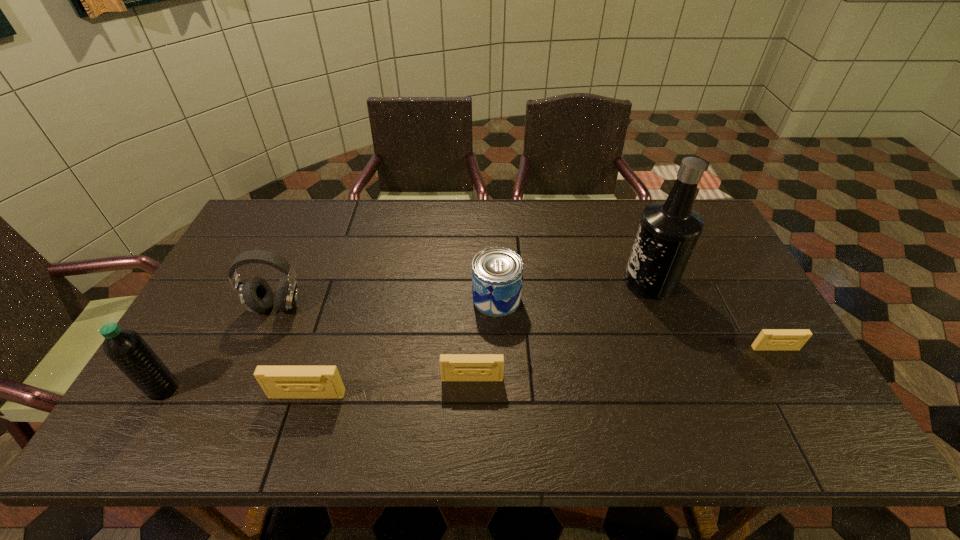
Where is `the sixth shortest object`? This screenshot has width=960, height=540. the sixth shortest object is located at coordinates (126, 348).

Find the location of a particular element. Image resolution: width=960 pixels, height=540 pixels. water bottle is located at coordinates (126, 348).

At what (x,y) coordinates should I click in order to perform the action: click on vacant region located at the front of the second nearest videotape with spools. Please return your answer as a coordinate pair (x, y). This screenshot has height=540, width=960. Looking at the image, I should click on (472, 402).

At what (x,y) coordinates should I click in order to perform the action: click on vacant region located 0.090m at the front of the rightmost videotape with spools. Please return your answer as a coordinate pair (x, y). This screenshot has height=540, width=960. Looking at the image, I should click on (795, 382).

Locate an element on the screen. The width and height of the screenshot is (960, 540). free spot located on the ear cups of the headset is located at coordinates (263, 338).

This screenshot has height=540, width=960. In order to click on vacant space positioned 0.120m on the front label of the liquor in this screenshot , I will do `click(584, 282)`.

The height and width of the screenshot is (540, 960). Identify the location of free space located 0.120m on the front label of the liquor. (584, 282).

Locate an element on the screen. This screenshot has width=960, height=540. free point located on the front label of the liquor is located at coordinates (537, 282).

This screenshot has width=960, height=540. I want to click on vacant point located 0.080m on the front label of the fourth tallest object, so click(444, 298).

You are a GUI agent. You are given a task and a screenshot of the screen. Output one action in this format:
    pyautogui.click(x=<x>, y=<y>)
    Task: Click on the free spot located 0.390m on the front label of the fourth tallest object
    
    Given the screenshot: What is the action you would take?
    pyautogui.click(x=338, y=298)